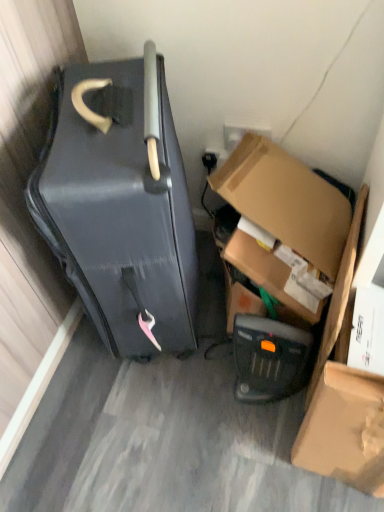
Question: Is black plastic heater at lower center taller or shorter than matte black suitcase at left?

Choices:
 (A) tall
 (B) short

Answer: (B)

Question: Is point (276, 344) positioned closer to the camera than point (173, 230)?

Choices:
 (A) closer
 (B) farther

Answer: (B)

Question: Which is nearer to the matte brown cardboard box at lower right?

Choices:
 (A) black plastic heater at lower center
 (B) matte black suitcase at left
 (C) cardboard box at lower right

Answer: (A)

Question: Based on their relative distances, which object is nearer to the matte black suitcase at left?

Choices:
 (A) cardboard box at lower right
 (B) matte brown cardboard box at lower right
 (C) black plastic heater at lower center

Answer: (A)